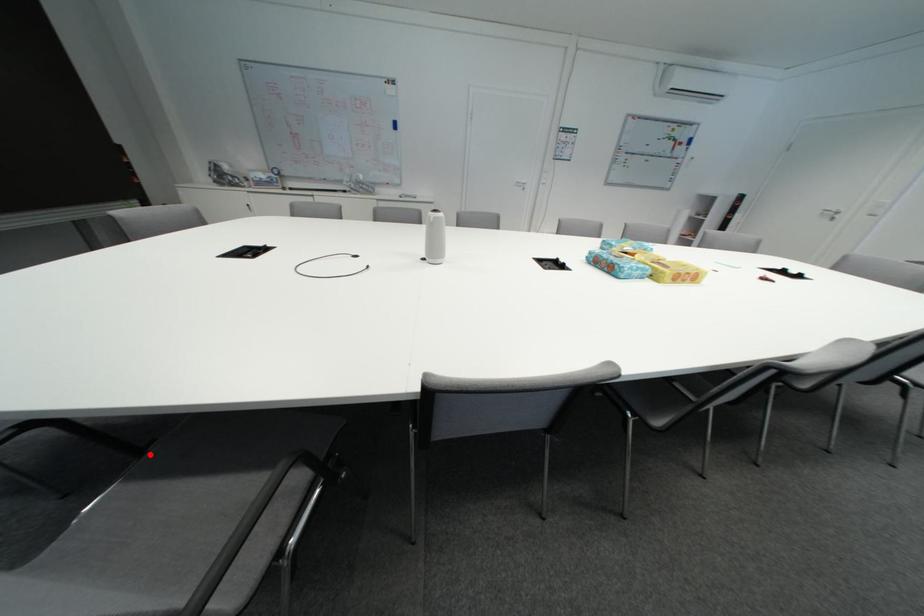
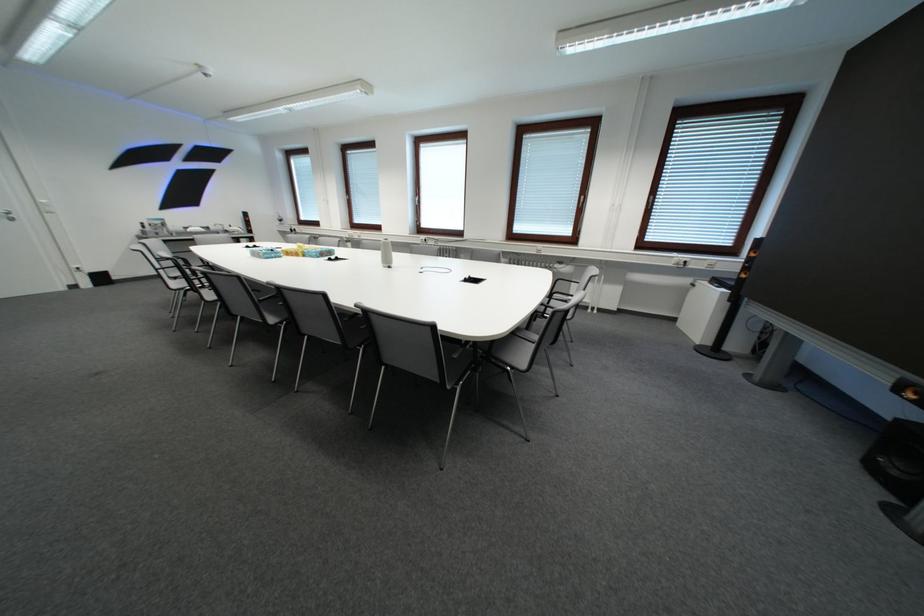
Question: I am providing you with two images of the same scene from different viewpoints. A red point is marked on the first image. Is the red point's position out of view in image 2?

Choices:
 (A) Yes
 (B) No

Answer: (A)